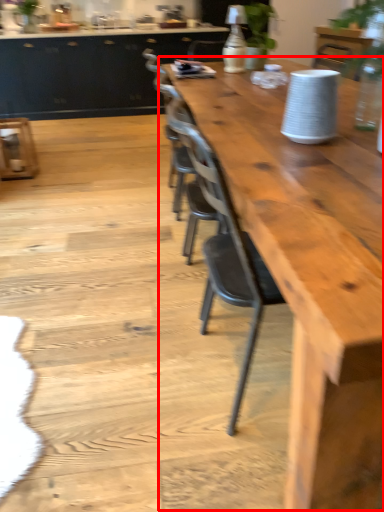
Question: From the image's perspective, what is the correct spatial relationship of table (annotated by the red box) in relation to cabinetry?

Choices:
 (A) below
 (B) above

Answer: (A)